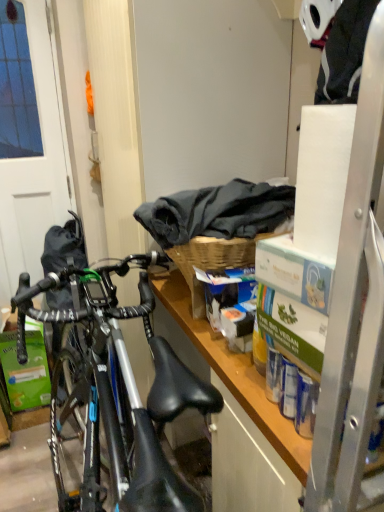
Image resolution: width=384 pixels, height=512 pixels. I want to click on woven wood picnic basket at center, so click(x=212, y=261).

Image resolution: width=384 pixels, height=512 pixels. In order to click on green cardboard box at lower left in this screenshot , I will do `click(26, 370)`.

The height and width of the screenshot is (512, 384). What do you see at coordinates (217, 212) in the screenshot?
I see `dark gray fabric at upper center` at bounding box center [217, 212].

Where is `matte white screen door at left`? The width and height of the screenshot is (384, 512). matte white screen door at left is located at coordinates (30, 142).

Image resolution: width=384 pixels, height=512 pixels. What are the coordinates of `wooden shelf at center` in the screenshot? It's located at (240, 415).

I want to click on woven wood picnic basket at center, so [212, 261].

From a real-world perspective, who is located lower, matte white screen door at left or green cardboard box at lower left?

From a 3D spatial view, green cardboard box at lower left is below.

Considering the relative sizes of matte white screen door at left and green cardboard box at lower left in the image provided, is matte white screen door at left smaller than green cardboard box at lower left?

Incorrect, matte white screen door at left is not smaller in size than green cardboard box at lower left.

Considering their positions, is matte white screen door at left located in front of or behind green cardboard box at lower left?

matte white screen door at left is positioned closer to the viewer than green cardboard box at lower left.

From their relative heights in the image, would you say green cardboard box at lower left is taller or shorter than matte white screen door at left?

In the image, green cardboard box at lower left appears to be shorter than matte white screen door at left.

Based on their sizes in the image, would you say green cardboard box at lower left is bigger or smaller than matte white screen door at left?

Considering their sizes, green cardboard box at lower left takes up less space than matte white screen door at left.

Is the position of green cardboard box at lower left less distant than that of matte white screen door at left?

No.

Between point (291, 431) and point (221, 249), which one is positioned behind?

Point (221, 249)

Is wooden shelf at center aimed at woven wood picnic basket at center?

No, wooden shelf at center is not aimed at woven wood picnic basket at center.

Is woven wood picnic basket at center completely or partially inside wooden shelf at center?

No, woven wood picnic basket at center is not surrounded by wooden shelf at center.

Consider the image. From the image's perspective, who appears lower, wooden shelf at center or woven wood picnic basket at center?

wooden shelf at center is shown below in the image.

Considering the points (257, 228) and (269, 509), which point is behind, point (257, 228) or point (269, 509)?

The point (257, 228) is behind.

Relative to wooden shelf at center, is dark gray fabric at upper center in front or behind?

Clearly, dark gray fabric at upper center is behind wooden shelf at center.

Can wooden shelf at center be found inside dark gray fabric at upper center?

Definitely not — wooden shelf at center is not inside dark gray fabric at upper center.

Which of these two, dark gray fabric at upper center or wooden shelf at center, is thinner?

dark gray fabric at upper center.

Is woven wood picnic basket at center bigger than green cardboard box at lower left?

Correct, woven wood picnic basket at center is larger in size than green cardboard box at lower left.

Considering the sizes of objects woven wood picnic basket at center and green cardboard box at lower left in the image provided, who is taller, woven wood picnic basket at center or green cardboard box at lower left?

Standing taller between the two is green cardboard box at lower left.

From a real-world perspective, is woven wood picnic basket at center positioned under green cardboard box at lower left based on gravity?

Actually, woven wood picnic basket at center is physically above green cardboard box at lower left in the real world.

Which is closer to the camera, [209,246] or [33,397]?

Point [209,246] is positioned closer to the camera compared to point [33,397].

From the image's perspective, is dark gray fabric at upper center above or below matte white screen door at left?

dark gray fabric at upper center is situated lower than matte white screen door at left in the image.

Is dark gray fabric at upper center far away from matte white screen door at left?

Yes, dark gray fabric at upper center and matte white screen door at left are located far from each other.

How many degrees apart are the facing directions of dark gray fabric at upper center and matte white screen door at left?

The angle between the facing direction of dark gray fabric at upper center and the facing direction of matte white screen door at left is 86.2 degrees.

Is dark gray fabric at upper center outside of woven wood picnic basket at center?

That's correct, dark gray fabric at upper center is outside of woven wood picnic basket at center.

Would you consider dark gray fabric at upper center to be distant from woven wood picnic basket at center?

No, dark gray fabric at upper center is in close proximity to woven wood picnic basket at center.

From the image's perspective, relative to woven wood picnic basket at center, is dark gray fabric at upper center above or below?

Based on their image positions, dark gray fabric at upper center is located above woven wood picnic basket at center.

Identify the location of box below the matte white screen door at left (from a real-world perspective). (26, 370).

You are a GUI agent. You are given a task and a screenshot of the screen. Output one action in this format:
    pyautogui.click(x=<x>, y=<y>)
    Task: Click on the screen door that is on the left side of green cardboard box at lower left
    The width and height of the screenshot is (384, 512).
    Given the screenshot: What is the action you would take?
    pyautogui.click(x=30, y=142)

Considering their positions, is green cardboard box at lower left positioned closer to matte white screen door at left than wooden shelf at center?

Based on the image, green cardboard box at lower left appears to be nearer to matte white screen door at left.

From the image, which object appears to be nearer to wooden shelf at center, woven wood picnic basket at center or green cardboard box at lower left?

woven wood picnic basket at center.

Consider the image. From the image, which object appears to be nearer to green cardboard box at lower left, wooden shelf at center or woven wood picnic basket at center?

Among the two, wooden shelf at center is located nearer to green cardboard box at lower left.

Estimate the real-world distances between objects in this image. Which object is closer to woven wood picnic basket at center, dark gray fabric at upper center or wooden shelf at center?

dark gray fabric at upper center lies closer to woven wood picnic basket at center than the other object.

Estimate the real-world distances between objects in this image. Which object is further from matte white screen door at left, woven wood picnic basket at center or wooden shelf at center?

wooden shelf at center.

From the image, which object appears to be farther from green cardboard box at lower left, woven wood picnic basket at center or dark gray fabric at upper center?

Based on the image, dark gray fabric at upper center appears to be further to green cardboard box at lower left.

Which object lies further to the anchor point green cardboard box at lower left, woven wood picnic basket at center or wooden shelf at center?

woven wood picnic basket at center is positioned further to the anchor green cardboard box at lower left.

When comparing their distances from woven wood picnic basket at center, does green cardboard box at lower left or dark gray fabric at upper center seem closer?

dark gray fabric at upper center lies closer to woven wood picnic basket at center than the other object.

At what (x,y) coordinates should I click in order to perform the action: click on picnic basket between dark gray fabric at upper center and wooden shelf at center vertically. Please return your answer as a coordinate pair (x, y). Looking at the image, I should click on (212, 261).

You are a GUI agent. You are given a task and a screenshot of the screen. Output one action in this format:
    pyautogui.click(x=<x>, y=<y>)
    Task: Click on the material between green cardboard box at lower left and wooden shelf at center from left to right
    The height and width of the screenshot is (512, 384).
    Given the screenshot: What is the action you would take?
    pyautogui.click(x=217, y=212)

Locate an element on the screen. Image resolution: width=384 pixels, height=512 pixels. picnic basket located between green cardboard box at lower left and wooden shelf at center in the left-right direction is located at coordinates (212, 261).

Find the location of a particular element. material situated between green cardboard box at lower left and woven wood picnic basket at center from left to right is located at coordinates (217, 212).